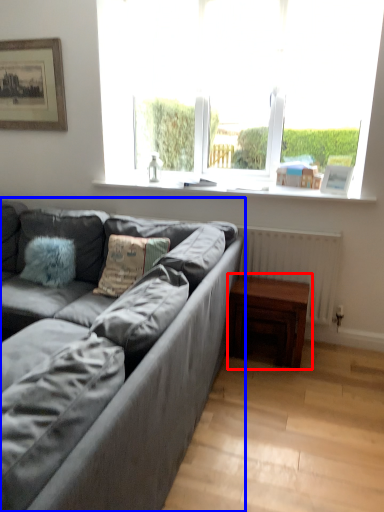
Question: Among these objects, which one is farthest to the camera, table (highlighted by a red box) or studio couch (highlighted by a blue box)?

Choices:
 (A) table
 (B) studio couch

Answer: (A)